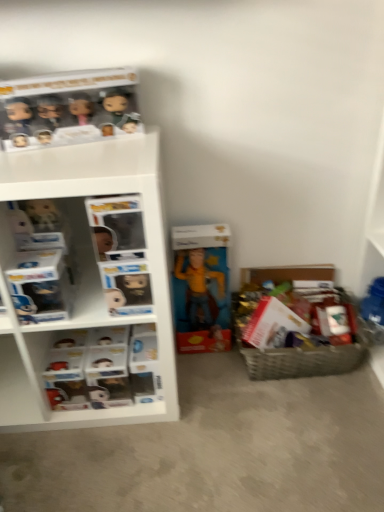
Identify the location of free spot to the left of woven brown basket at lower right. (212, 384).